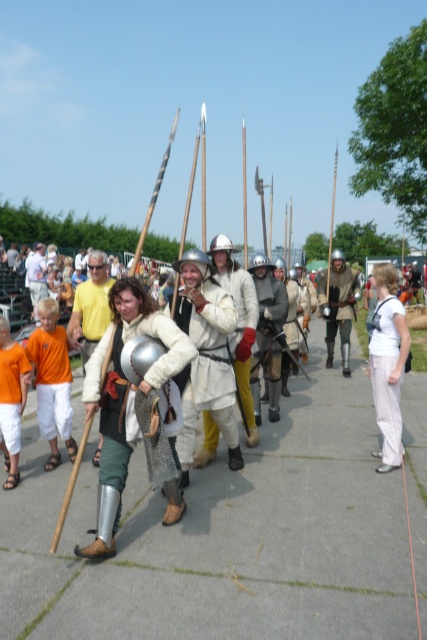
You are a participant in the historical reenactment event and need to move from your current position to a specific location marked by point (90, 285). There is an obstacle at point (52, 435). Will you encounter this obstacle before reaching your destination?

Yes, you will encounter the obstacle at point (52, 435) before reaching point (90, 285) because point (52, 435) is in front of point (90, 285).

Based on the photo, you are a costume designer observing the historical reenactment. You need to determine which costume has a longer length between the orange cotton shirt at left and the leather armor at center. Which one is longer?

The leather armor at center is longer than the orange cotton shirt at left.

You are a costume designer assessing the historical accuracy of the outfits in the scene. Given that the chainmail shirt at center and the leather armor at center are both worn by the central figure, which one has a greater horizontal extent when viewed from the front?

The chainmail shirt at center has a greater horizontal extent than the leather armor at center, as its width is larger according to the description.